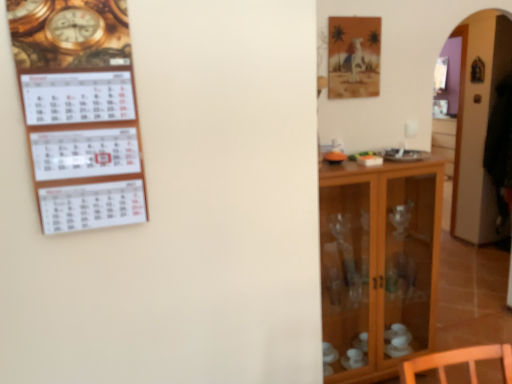
Question: From their relative heights in the image, would you say matte brown picture frame at upper right is taller or shorter than transparent glass cabinet at right?

Choices:
 (A) tall
 (B) short

Answer: (B)

Question: In the image, is matte brown picture frame at upper right on the left side or the right side of transparent glass cabinet at right?

Choices:
 (A) left
 (B) right

Answer: (A)

Question: Which is farther from the wooden cabinet at right?

Choices:
 (A) white paper calendar at left
 (B) matte brown picture frame at upper right
 (C) transparent glass cabinet at right

Answer: (C)

Question: Estimate the real-world distances between objects in this image. Which object is closer to the matte brown picture frame at upper right?

Choices:
 (A) transparent glass cabinet at right
 (B) wooden cabinet at right
 (C) white paper calendar at left

Answer: (B)